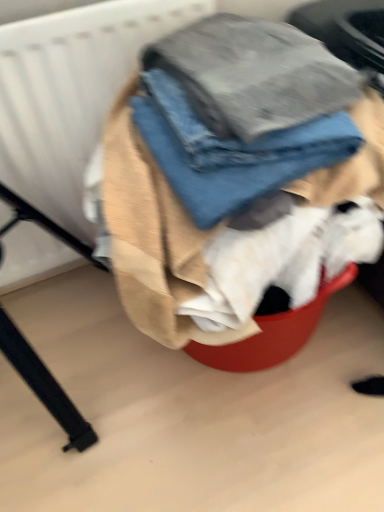
Question: Can you confirm if white textured radiator at upper left is thinner than denim jeans at center?

Choices:
 (A) yes
 (B) no

Answer: (A)

Question: Does white textured radiator at upper left have a larger size compared to denim jeans at center?

Choices:
 (A) yes
 (B) no

Answer: (A)

Question: From a real-world perspective, is white textured radiator at upper left physically above denim jeans at center?

Choices:
 (A) no
 (B) yes

Answer: (A)

Question: From the image's perspective, is white textured radiator at upper left beneath denim jeans at center?

Choices:
 (A) no
 (B) yes

Answer: (A)

Question: Is white textured radiator at upper left oriented away from denim jeans at center?

Choices:
 (A) no
 (B) yes

Answer: (A)

Question: Considering the positions of white textured radiator at upper left and denim fabric at center in the image, is white textured radiator at upper left taller or shorter than denim fabric at center?

Choices:
 (A) short
 (B) tall

Answer: (B)

Question: Would you say white textured radiator at upper left is inside or outside denim fabric at center?

Choices:
 (A) outside
 (B) inside

Answer: (A)

Question: From a real-world perspective, is white textured radiator at upper left positioned above or below denim fabric at center?

Choices:
 (A) above
 (B) below

Answer: (B)

Question: Based on their positions, is white textured radiator at upper left located to the left or right of denim fabric at center?

Choices:
 (A) left
 (B) right

Answer: (A)

Question: Considering the positions of denim fabric at center and white textured radiator at upper left in the image, is denim fabric at center wider or thinner than white textured radiator at upper left?

Choices:
 (A) thin
 (B) wide

Answer: (B)

Question: Considering the positions of denim fabric at center and white textured radiator at upper left in the image, is denim fabric at center taller or shorter than white textured radiator at upper left?

Choices:
 (A) short
 (B) tall

Answer: (A)

Question: Is point (168, 46) closer or farther from the camera than point (3, 159)?

Choices:
 (A) farther
 (B) closer

Answer: (B)

Question: Considering their positions, is denim fabric at center located in front of or behind white textured radiator at upper left?

Choices:
 (A) behind
 (B) front

Answer: (B)

Question: Does point 190,138 appear closer or farther from the camera than point 183,30?

Choices:
 (A) farther
 (B) closer

Answer: (B)

Question: Is denim jeans at center wider or thinner than denim fabric at center?

Choices:
 (A) wide
 (B) thin

Answer: (B)